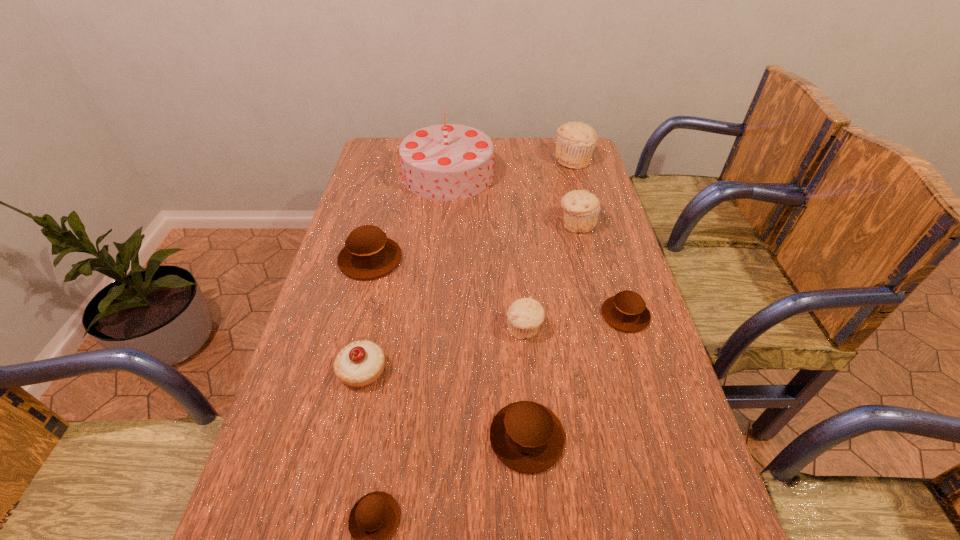
Where is `free space located 0.100m on the back of the third farthest brown muffin`? free space located 0.100m on the back of the third farthest brown muffin is located at coordinates (521, 363).

Locate an element on the screen. The height and width of the screenshot is (540, 960). blank space located 0.080m on the back of the beige pastry is located at coordinates (372, 324).

This screenshot has height=540, width=960. What are the coordinates of `free space located 0.370m on the left of the third biggest brown muffin` in the screenshot? It's located at (454, 315).

Identify the location of birthday cake at the far edge. Image resolution: width=960 pixels, height=540 pixels. (445, 162).

This screenshot has width=960, height=540. What are the coordinates of `muffin that is at the far edge` in the screenshot? It's located at (576, 141).

This screenshot has height=540, width=960. Identify the location of birthday cake at the left edge. (445, 162).

The width and height of the screenshot is (960, 540). I want to click on muffin located in the left edge section of the desktop, so click(368, 254).

This screenshot has height=540, width=960. Identify the location of pastry that is at the left edge. (359, 364).

Find the location of a particular element. object located at the far left corner is located at coordinates click(445, 162).

You are a GUI agent. You are given a task and a screenshot of the screen. Output one action in this format:
    pyautogui.click(x=<x>, y=<y>)
    Task: Click on the object that is at the far right corner
    Image resolution: width=960 pixels, height=540 pixels.
    Given the screenshot: What is the action you would take?
    pyautogui.click(x=576, y=141)